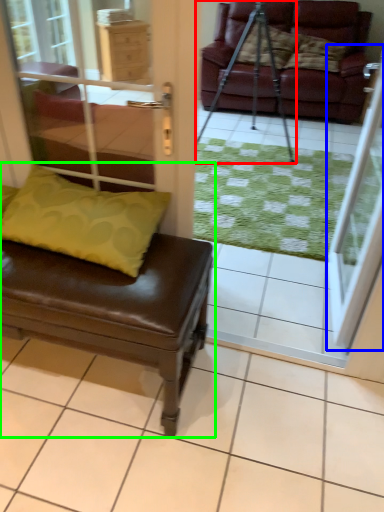
Question: Estimate the real-world distances between objects in this image. Which object is farther from tripod (highlighted by a red box), screen door (highlighted by a blue box) or studio couch (highlighted by a green box)?

Choices:
 (A) screen door
 (B) studio couch

Answer: (B)